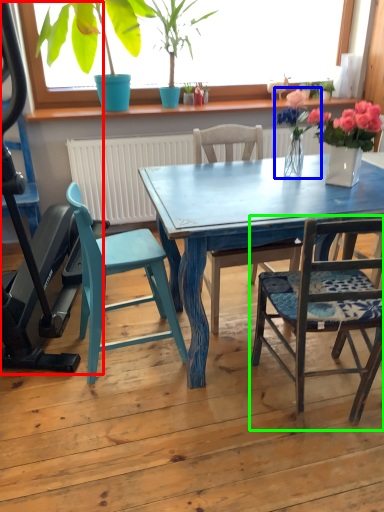
Question: Which object is the closest to the baby carriage (highlighted by a red box)? Choose among these: floral arrangement (highlighted by a blue box) or chair (highlighted by a green box).

Choices:
 (A) floral arrangement
 (B) chair

Answer: (B)